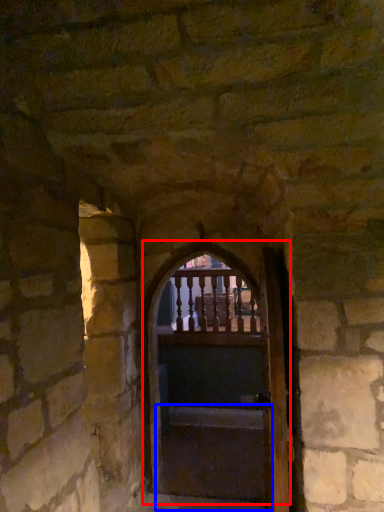
Question: Which point is further to the camera, door (highlighted by a red box) or stairs (highlighted by a blue box)?

Choices:
 (A) door
 (B) stairs

Answer: (B)